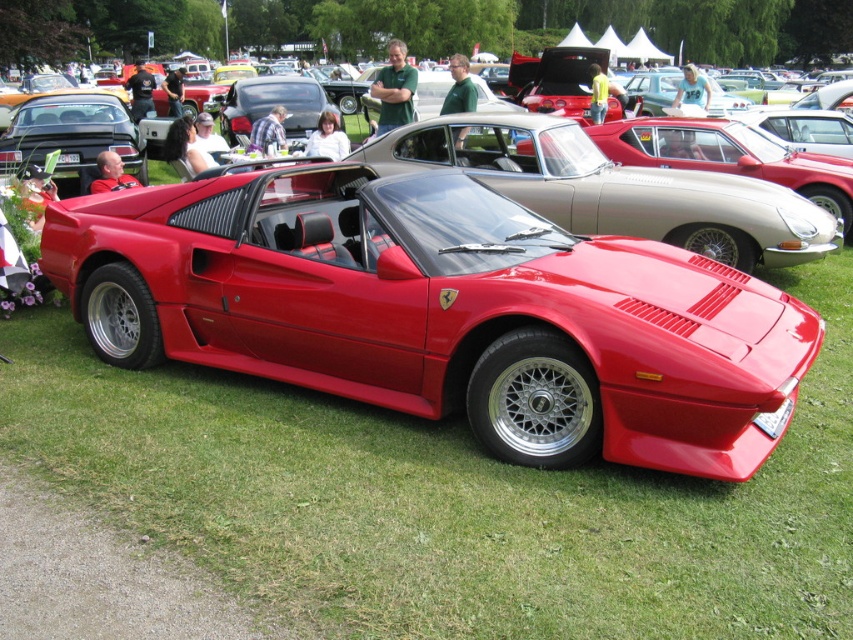
Question: Which object is closer to the camera taking this photo?

Choices:
 (A) shiny red sports car at center
 (B) metallic silver convertible at center

Answer: (A)

Question: Among these points, which one is nearest to the camera?

Choices:
 (A) (541, 243)
 (B) (717, 211)

Answer: (A)

Question: Does shiny red sports car at center appear over metallic silver convertible at center?

Choices:
 (A) no
 (B) yes

Answer: (A)

Question: Can you confirm if shiny red sports car at center is bigger than metallic silver convertible at center?

Choices:
 (A) yes
 (B) no

Answer: (A)

Question: Is shiny red sports car at center positioned before metallic silver convertible at center?

Choices:
 (A) no
 (B) yes

Answer: (B)